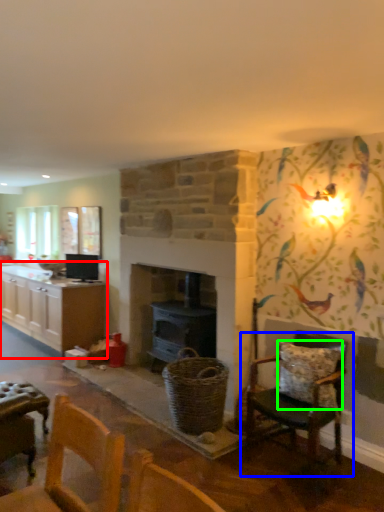
Question: Estimate the real-world distances between objects in this image. Which object is farther from cabinetry (highlighted by a red box), chair (highlighted by a blue box) or pillow (highlighted by a green box)?

Choices:
 (A) chair
 (B) pillow

Answer: (B)